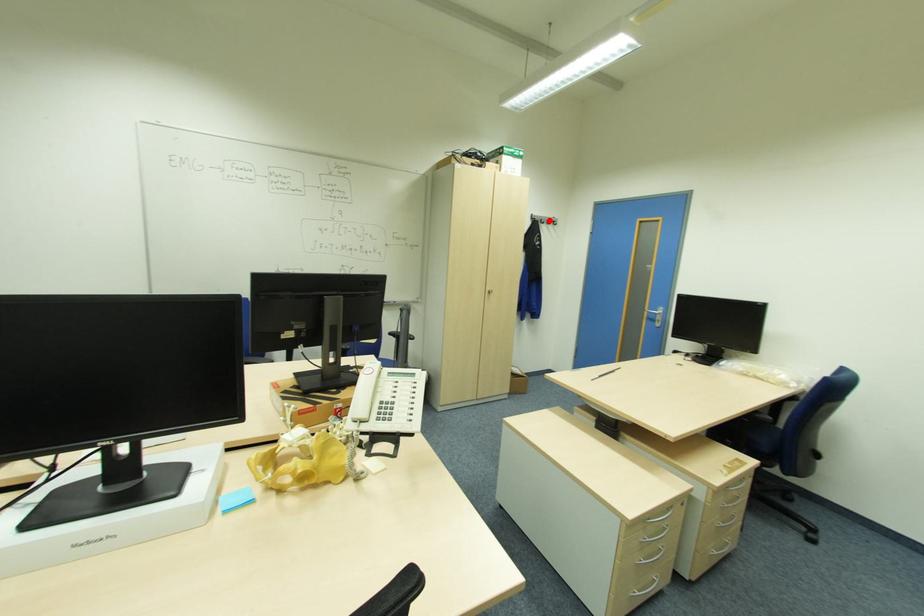
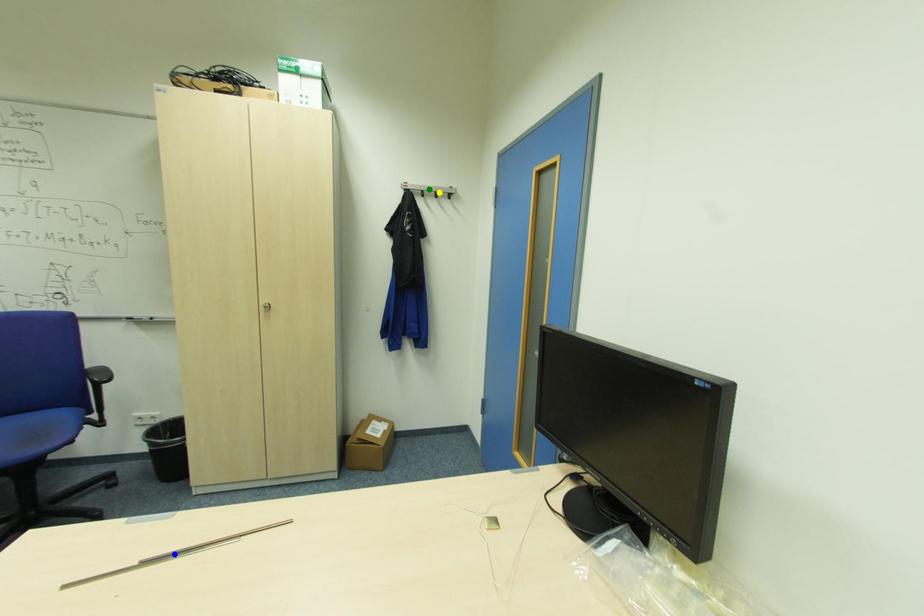
Question: I am providing you with two images of the same scene from different viewpoints. A red point is marked on the first image. You are given multiple points on the second image. Can you choose the point in image 2 that corresponds to the point in image 1?

Choices:
 (A) blue point
 (B) green point
 (C) yellow point

Answer: (C)